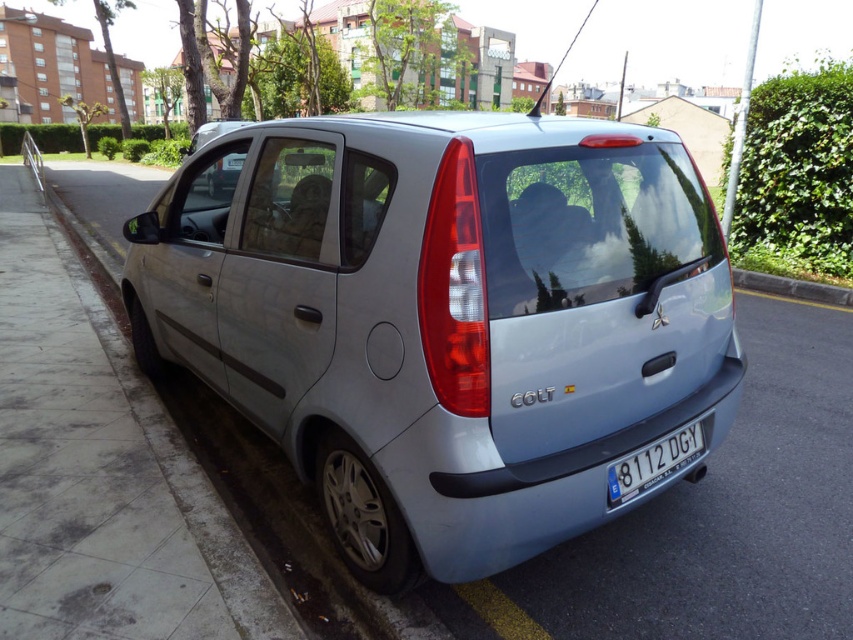
Is satin silver car at center positioned behind white plastic license plate at center?

No, satin silver car at center is closer to the viewer.

Consider the image. Can you confirm if satin silver car at center is thinner than white plastic license plate at center?

In fact, satin silver car at center might be wider than white plastic license plate at center.

Is point (399, 342) positioned in front of point (657, 460)?

Yes, point (399, 342) is closer to viewer.

You are a GUI agent. You are given a task and a screenshot of the screen. Output one action in this format:
    pyautogui.click(x=<x>, y=<y>)
    Task: Click on the satin silver car at center
    
    Given the screenshot: What is the action you would take?
    [444, 317]